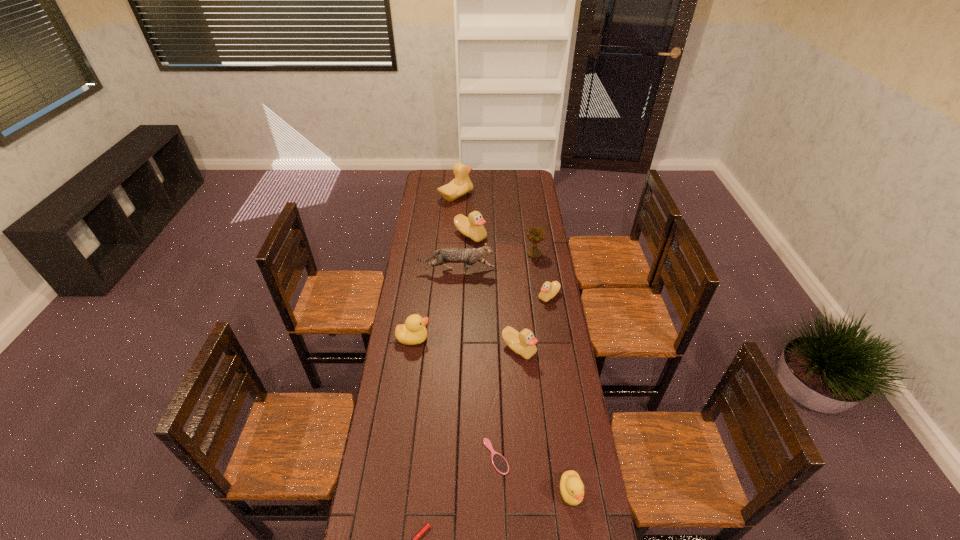
This screenshot has height=540, width=960. What are the coordinates of `the left yellow duck` in the screenshot? It's located at (413, 332).

What are the coordinates of `the third farthest beige duck` in the screenshot? It's located at (549, 290).

Locate an element on the screen. Image resolution: width=960 pixels, height=540 pixels. the sixth nearest object is located at coordinates pos(549,290).

Find the location of a particular element. This screenshot has height=540, width=960. the right yellow duck is located at coordinates (571, 487).

Locate an element on the screen. This screenshot has width=960, height=540. the nearest duck is located at coordinates (571, 487).

At what (x,y) coordinates should I click in order to perform the action: click on the third nearest object. Please return your answer as a coordinate pair (x, y). Looking at the image, I should click on (499, 462).

At what (x,y) coordinates should I click in order to perform the action: click on hairbrush. Please return your answer as a coordinate pair (x, y). Looking at the image, I should click on (499, 462).

Identify the location of vacant space located 0.340m at the beak of the farthest duck. (529, 196).

Where is `free space located 0.210m on the face of the fourth farthest object`? free space located 0.210m on the face of the fourth farthest object is located at coordinates (538, 272).

The height and width of the screenshot is (540, 960). Find the location of `vacant space situated 0.220m at the beak of the second farthest beige duck`. vacant space situated 0.220m at the beak of the second farthest beige duck is located at coordinates (469, 273).